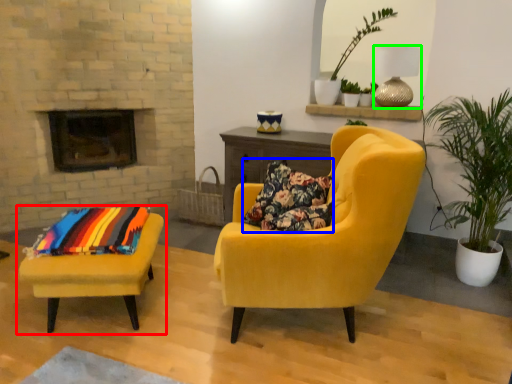
Question: Considering the real-world distances, which object is farthest from chair (highlighted by a red box)? pillow (highlighted by a blue box) or lamp (highlighted by a green box)?

Choices:
 (A) pillow
 (B) lamp

Answer: (B)